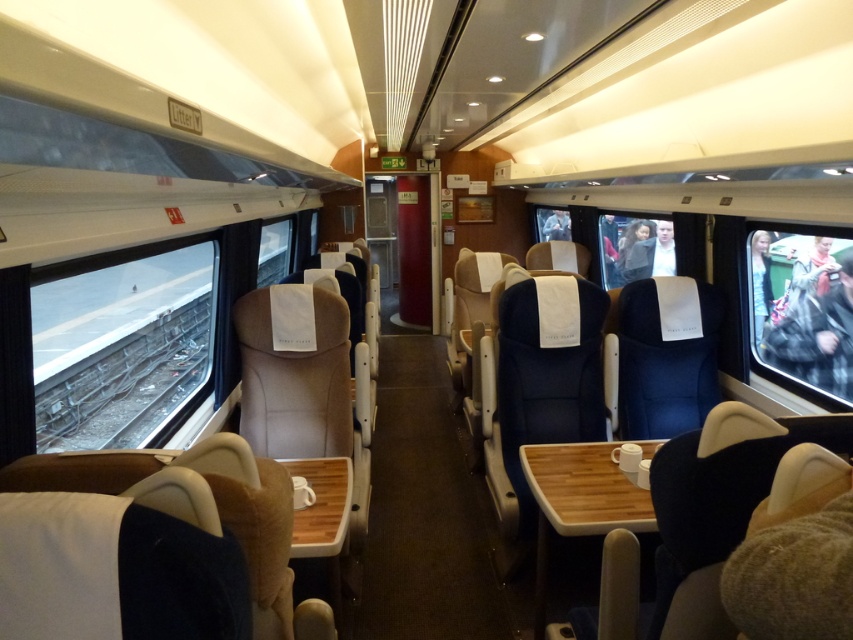
From the picture: You are a passenger in the train carriage and want to check the outside view through the transparent plastic window at right and the clear glass window at center. Which window should you choose if you want a better view?

The clear glass window at center provides a better view because it is larger than the transparent plastic window at right.

You are a passenger on the train and want to place your backpack on the seat next to you. The backpack is as wide as the light blue fabric jacket at center. Can you place it without touching the clear glass window at center?

The clear glass window at center is wider than the light blue fabric jacket at center. Since your backpack is as wide as the light blue fabric jacket at center, it should fit without touching the clear glass window at center.